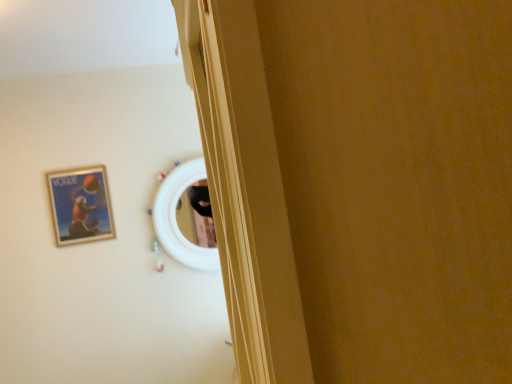
Question: Does white glossy mirror at center have a larger size compared to wooden glossy picture frame at upper left?

Choices:
 (A) no
 (B) yes

Answer: (B)

Question: Is white glossy mirror at center not within wooden glossy picture frame at upper left?

Choices:
 (A) yes
 (B) no

Answer: (A)

Question: Is white glossy mirror at center far from wooden glossy picture frame at upper left?

Choices:
 (A) yes
 (B) no

Answer: (B)

Question: From the image's perspective, is white glossy mirror at center beneath wooden glossy picture frame at upper left?

Choices:
 (A) no
 (B) yes

Answer: (B)

Question: Is white glossy mirror at center directly adjacent to wooden glossy picture frame at upper left?

Choices:
 (A) yes
 (B) no

Answer: (B)

Question: Considering the relative sizes of white glossy mirror at center and wooden glossy picture frame at upper left in the image provided, is white glossy mirror at center thinner than wooden glossy picture frame at upper left?

Choices:
 (A) yes
 (B) no

Answer: (B)

Question: Is wooden glossy picture frame at upper left positioned before white glossy mirror at center?

Choices:
 (A) no
 (B) yes

Answer: (B)

Question: Is wooden glossy picture frame at upper left facing towards white glossy mirror at center?

Choices:
 (A) no
 (B) yes

Answer: (A)

Question: Is wooden glossy picture frame at upper left outside of white glossy mirror at center?

Choices:
 (A) yes
 (B) no

Answer: (A)

Question: From a real-world perspective, does wooden glossy picture frame at upper left sit lower than white glossy mirror at center?

Choices:
 (A) yes
 (B) no

Answer: (B)

Question: From a real-world perspective, is wooden glossy picture frame at upper left on white glossy mirror at center?

Choices:
 (A) no
 (B) yes

Answer: (B)

Question: Can you confirm if wooden glossy picture frame at upper left is thinner than white glossy mirror at center?

Choices:
 (A) no
 (B) yes

Answer: (B)

Question: Is white glossy mirror at center bigger or smaller than wooden glossy picture frame at upper left?

Choices:
 (A) small
 (B) big

Answer: (B)